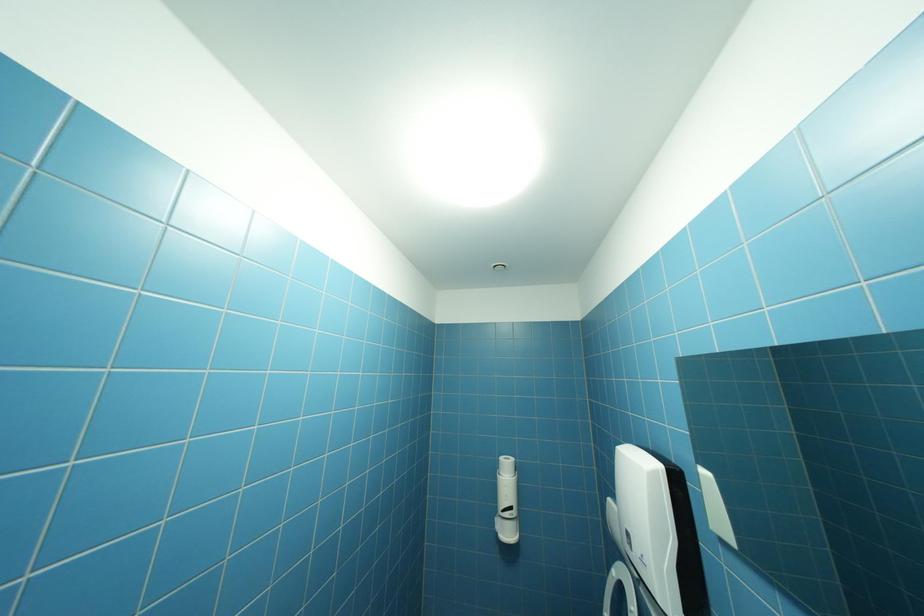
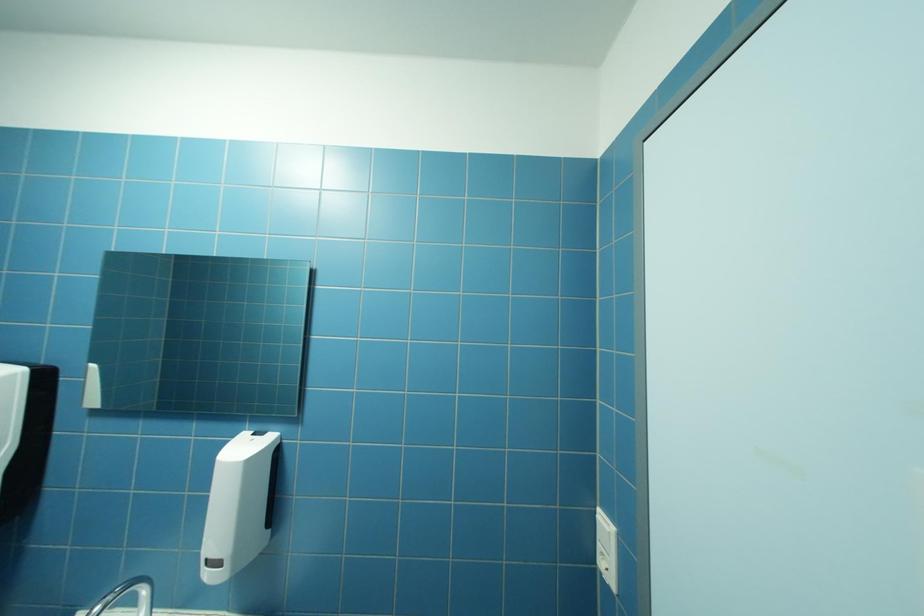
Question: The images are taken continuously from a first-person perspective. In which direction is your viewpoint rotating?

Choices:
 (A) Left
 (B) Right
 (C) Up
 (D) Down

Answer: (B)